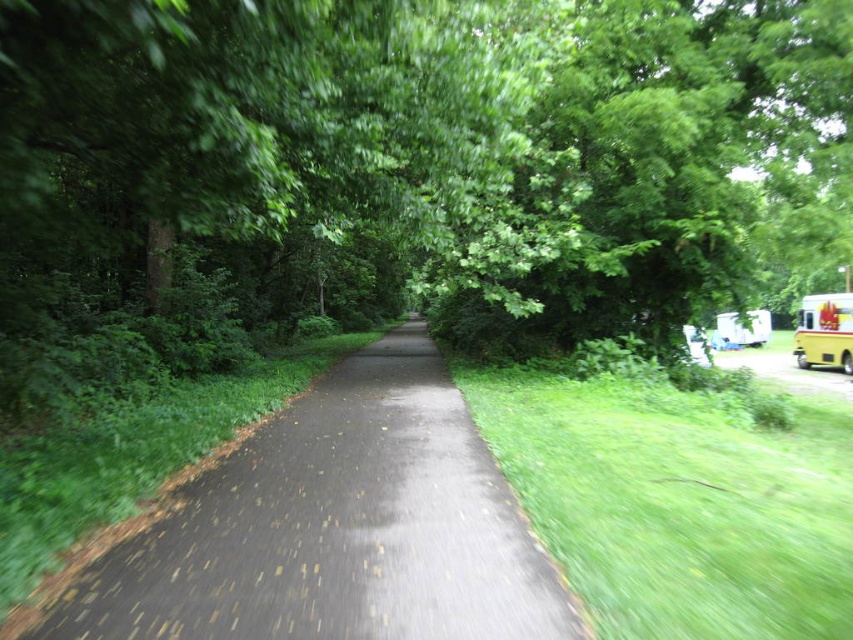
You are a hiker trying to determine the best route through the forest. You see a green leafy tree at center and a black asphalt path at center. Which object is taller?

The green leafy tree at center is much taller than the black asphalt path at center.

You are a delivery driver who needs to drive a truck that is 3 meters tall through the forest path. You see the black asphalt path at center and the yellow matte school bus at right. Based on their heights, can your truck pass through the path without hitting anything?

The black asphalt path at center is not as tall as the yellow matte school bus at right, which means the path is shorter in height than the school bus. Since the truck is 3 meters tall, if the path allows clearance equal to or greater than the school bus height, the truck can pass. However, since the path is shorter, it might be too low. Wait, there might be confusion here. Let me think again. The description says the path is not as tall as the bus. So the path itself has a height? That doesn t make sense.

You are a hiker walking along the black asphalt path at center. You want to reach the green leafy tree at center. Which direction should you move to get closer to the tree?

The green leafy tree at center is further to the viewer than the black asphalt path at center, so you should move forward along the path to get closer to the tree.